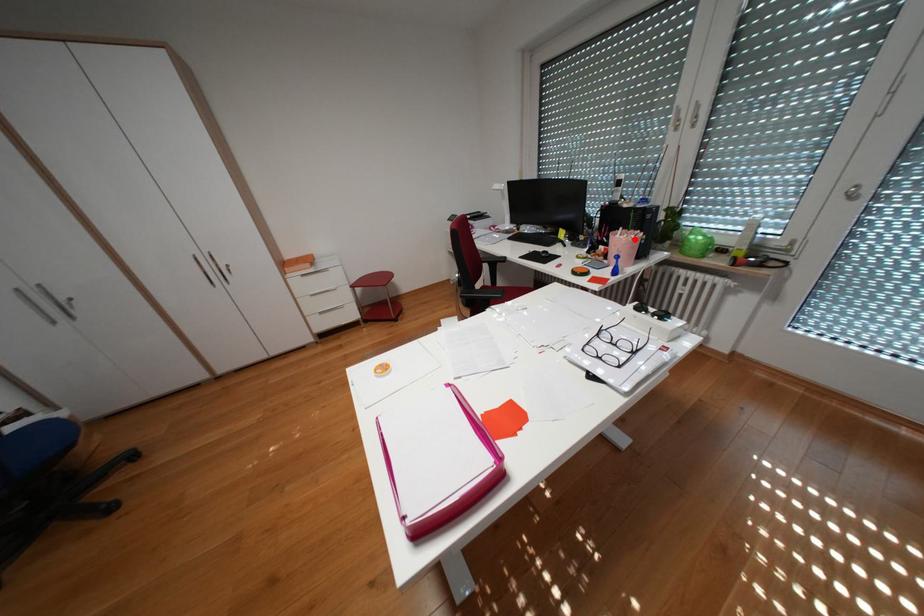
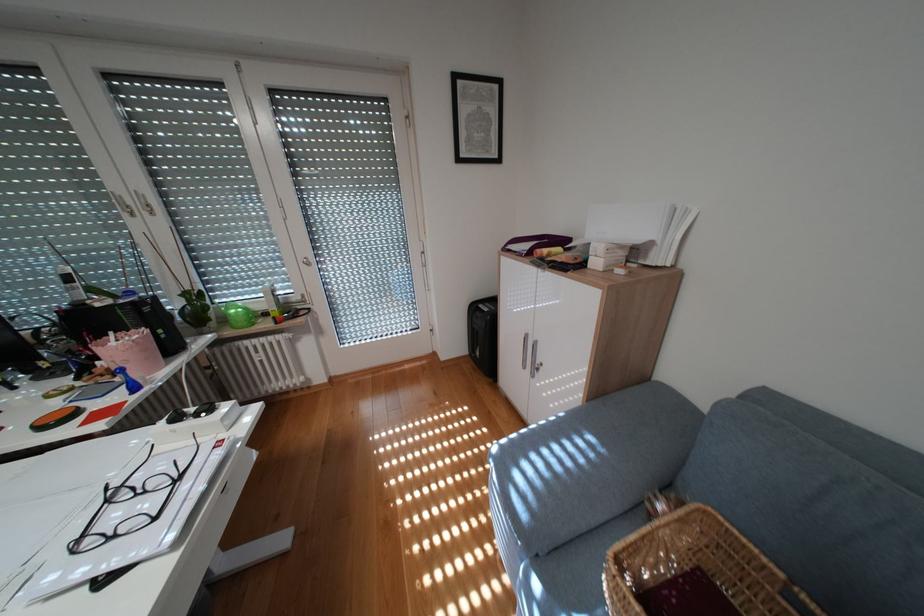
Locate, in the second image, the point that corresponds to the highlighted location in the first image.

(136, 345)